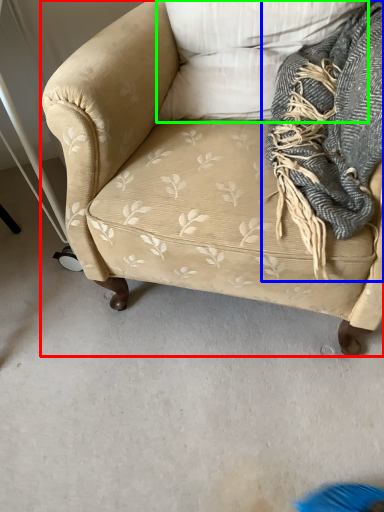
Question: Considering the real-world distances, which object is farthest from studio couch (highlighted by a red box)? scarf (highlighted by a blue box) or pillow (highlighted by a green box)?

Choices:
 (A) scarf
 (B) pillow

Answer: (A)